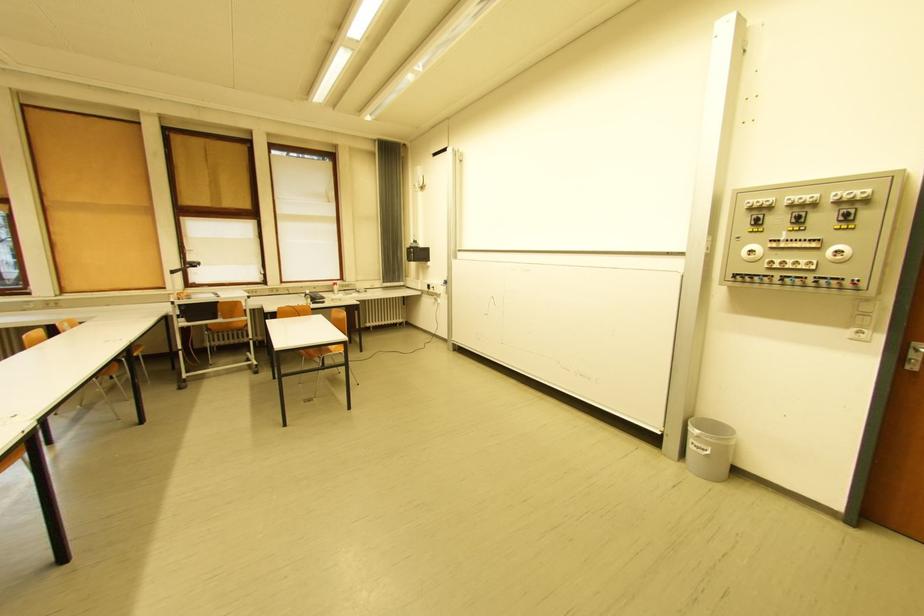
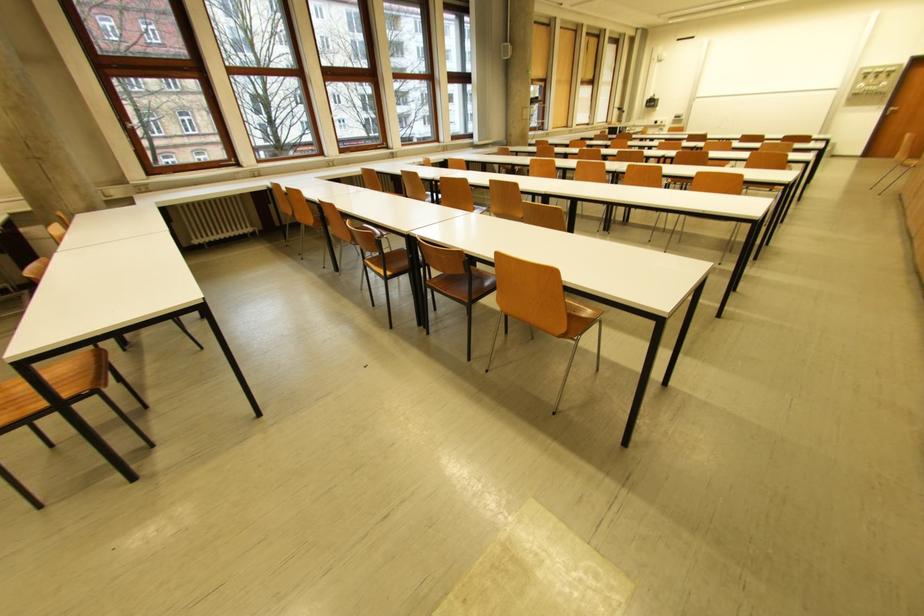
Where in the second image is the point corresponding to the point at 830,219 from the first image?

(890, 77)